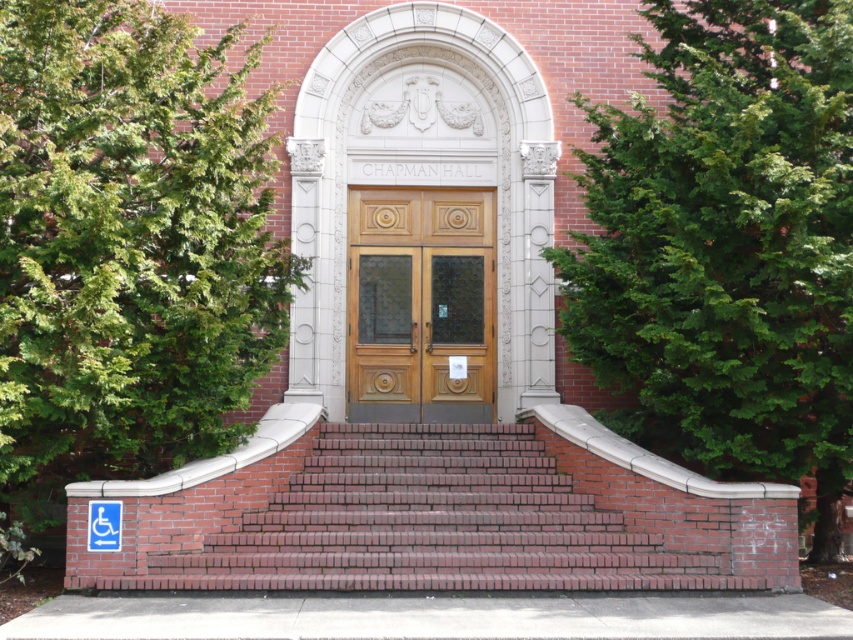
Can you confirm if green leafy tree at upper right is positioned below wooden door at center?

No.

Is green leafy tree at upper right shorter than wooden door at center?

Incorrect, green leafy tree at upper right's height does not fall short of wooden door at center's.

Is point (787, 346) positioned before point (347, 339)?

Yes, point (787, 346) is closer to viewer.

This screenshot has height=640, width=853. In order to click on green leafy tree at upper right in this screenshot , I will do `click(726, 248)`.

Locate an element on the screen. green leafy tree at left is located at coordinates (126, 248).

Can you confirm if green leafy tree at left is bigger than wooden door at center?

Indeed, green leafy tree at left has a larger size compared to wooden door at center.

Between point (184, 32) and point (367, 216), which one is positioned in front?

Point (184, 32)

The width and height of the screenshot is (853, 640). Identify the location of green leafy tree at left. pos(126,248).

Which is below, green leafy tree at upper right or brick stairs at center?

Positioned lower is brick stairs at center.

Is point (701, 355) closer to viewer compared to point (734, 504)?

Yes, it is.

You are a GUI agent. You are given a task and a screenshot of the screen. Output one action in this format:
    pyautogui.click(x=<x>, y=<y>)
    Task: Click on the green leafy tree at upper right
    The width and height of the screenshot is (853, 640).
    Given the screenshot: What is the action you would take?
    pyautogui.click(x=726, y=248)